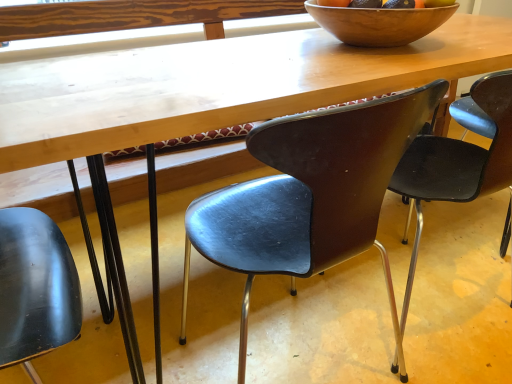
The width and height of the screenshot is (512, 384). Describe the element at coordinates (35, 287) in the screenshot. I see `matte black chair at lower left, which is counted as the first chair, starting from the left` at that location.

Measure the distance between matte brown chair at upper right, which is the third chair in left-to-right order, and camera.

A distance of 30.34 inches exists between matte brown chair at upper right, which is the third chair in left-to-right order, and camera.

The width and height of the screenshot is (512, 384). What do you see at coordinates (309, 196) in the screenshot?
I see `matte black chair at center, arranged as the second chair when viewed from the left` at bounding box center [309, 196].

Locate an element on the screen. The width and height of the screenshot is (512, 384). matte black chair at lower left, the 3th chair when ordered from right to left is located at coordinates (35, 287).

Considering the sizes of objects matte brown chair at upper right, the first chair from the right, and wooden bowl at upper center in the image provided, who is thinner, matte brown chair at upper right, the first chair from the right, or wooden bowl at upper center?

With smaller width is wooden bowl at upper center.

Which object is positioned more to the left, matte brown chair at upper right, which is the third chair in left-to-right order, or wooden bowl at upper center?

Positioned to the left is wooden bowl at upper center.

Would you say wooden bowl at upper center is part of matte brown chair at upper right, the first chair from the right,'s contents?

No, wooden bowl at upper center is located outside of matte brown chair at upper right, the first chair from the right.

Which of these two, matte brown chair at upper right, which is the third chair in left-to-right order, or wooden bowl at upper center, is bigger?

With larger size is matte brown chair at upper right, which is the third chair in left-to-right order.

Who is smaller, matte black chair at center, the second chair viewed from the right, or wooden bowl at upper center?

With smaller size is wooden bowl at upper center.

From the image's perspective, between matte black chair at center, the second chair viewed from the right, and wooden bowl at upper center, which one is located above?

From the image's view, wooden bowl at upper center is above.

Which point is more distant from viewer, [256,146] or [362,23]?

The point [362,23] is farther.

Considering the sizes of objects matte black chair at center, arranged as the second chair when viewed from the left, and wooden bowl at upper center in the image provided, who is taller, matte black chair at center, arranged as the second chair when viewed from the left, or wooden bowl at upper center?

matte black chair at center, arranged as the second chair when viewed from the left.

Is wooden bowl at upper center not within matte black chair at center, the second chair viewed from the right?

wooden bowl at upper center lies outside matte black chair at center, the second chair viewed from the right,'s area.

Does wooden bowl at upper center have a greater height compared to matte black chair at center, arranged as the second chair when viewed from the left?

No.

Does point (417, 9) appear closer or farther from the camera than point (308, 131)?

Point (417, 9) is farther from the camera than point (308, 131).

Consider the image. Does wooden bowl at upper center have a lesser height compared to matte black chair at lower left, the 3th chair when ordered from right to left?

Yes, wooden bowl at upper center is shorter than matte black chair at lower left, the 3th chair when ordered from right to left.

Between wooden bowl at upper center and matte black chair at lower left, which is counted as the first chair, starting from the left, which one has smaller width?

matte black chair at lower left, which is counted as the first chair, starting from the left, is thinner.

From a real-world perspective, is wooden bowl at upper center physically below matte black chair at lower left, the 3th chair when ordered from right to left?

No, from a real-world perspective, wooden bowl at upper center is not under matte black chair at lower left, the 3th chair when ordered from right to left.

From the image's perspective, who appears lower, matte brown chair at upper right, which is the third chair in left-to-right order, or matte black chair at center, the second chair viewed from the right?

matte black chair at center, the second chair viewed from the right, is shown below in the image.

Between matte brown chair at upper right, which is the third chair in left-to-right order, and matte black chair at center, arranged as the second chair when viewed from the left, which one has larger size?

matte black chair at center, arranged as the second chair when viewed from the left.

Is point (506, 144) closer to viewer compared to point (185, 219)?

Yes.

How different are the orientations of matte brown chair at upper right, which is the third chair in left-to-right order, and matte black chair at center, the second chair viewed from the right, in degrees?

0.000337 degrees.

Considering the relative sizes of matte black chair at lower left, which is counted as the first chair, starting from the left, and wooden bowl at upper center in the image provided, is matte black chair at lower left, which is counted as the first chair, starting from the left, bigger than wooden bowl at upper center?

Yes.

Would you say matte black chair at lower left, which is counted as the first chair, starting from the left, is to the left or to the right of wooden bowl at upper center in the picture?

matte black chair at lower left, which is counted as the first chair, starting from the left, is to the left of wooden bowl at upper center.

Is matte black chair at lower left, the 3th chair when ordered from right to left, in front of or behind wooden bowl at upper center in the image?

matte black chair at lower left, the 3th chair when ordered from right to left, is in front of wooden bowl at upper center.

There is a matte black chair at lower left, which is counted as the first chair, starting from the left. At what (x,y) coordinates should I click in order to perform the action: click on bowl above it (from a real-world perspective). Please return your answer as a coordinate pair (x, y). This screenshot has height=384, width=512. Looking at the image, I should click on (379, 23).

Considering the sizes of objects matte black chair at center, arranged as the second chair when viewed from the left, and matte brown chair at upper right, which is the third chair in left-to-right order, in the image provided, who is wider, matte black chair at center, arranged as the second chair when viewed from the left, or matte brown chair at upper right, which is the third chair in left-to-right order,?

matte black chair at center, arranged as the second chair when viewed from the left.

Based on the photo, from a real-world perspective, is matte black chair at center, the second chair viewed from the right, above or below matte brown chair at upper right, the first chair from the right?

matte black chair at center, the second chair viewed from the right, is situated higher than matte brown chair at upper right, the first chair from the right, in the real world.

Considering the sizes of objects matte black chair at center, the second chair viewed from the right, and matte brown chair at upper right, the first chair from the right, in the image provided, who is taller, matte black chair at center, the second chair viewed from the right, or matte brown chair at upper right, the first chair from the right,?

With more height is matte black chair at center, the second chair viewed from the right.

Does matte black chair at center, the second chair viewed from the right, lie in front of matte brown chair at upper right, which is the third chair in left-to-right order?

Yes.

Where is `chair that is the 1st object located in front of the wooden bowl at upper center`? The height and width of the screenshot is (384, 512). chair that is the 1st object located in front of the wooden bowl at upper center is located at coordinates (457, 164).

Where is `bowl lying on the right of matte black chair at center, arranged as the second chair when viewed from the left`? The image size is (512, 384). bowl lying on the right of matte black chair at center, arranged as the second chair when viewed from the left is located at coordinates (379, 23).

Based on their spatial positions, is matte black chair at center, the second chair viewed from the right, or matte black chair at lower left, which is counted as the first chair, starting from the left, closer to wooden bowl at upper center?

Based on the image, matte black chair at center, the second chair viewed from the right, appears to be nearer to wooden bowl at upper center.

Looking at the image, which one is located further to wooden bowl at upper center, matte black chair at center, the second chair viewed from the right, or matte brown chair at upper right, which is the third chair in left-to-right order?

matte black chair at center, the second chair viewed from the right, is further to wooden bowl at upper center.

Estimate the real-world distances between objects in this image. Which object is further from matte black chair at lower left, which is counted as the first chair, starting from the left, matte brown chair at upper right, the first chair from the right, or wooden bowl at upper center?

Based on the image, matte brown chair at upper right, the first chair from the right, appears to be further to matte black chair at lower left, which is counted as the first chair, starting from the left.

Considering their positions, is wooden bowl at upper center positioned further to matte black chair at lower left, the 3th chair when ordered from right to left, than matte brown chair at upper right, the first chair from the right?

matte brown chair at upper right, the first chair from the right.

From the image, which object appears to be farther from wooden bowl at upper center, matte black chair at lower left, the 3th chair when ordered from right to left, or matte black chair at center, arranged as the second chair when viewed from the left?

matte black chair at lower left, the 3th chair when ordered from right to left, is further to wooden bowl at upper center.

Estimate the real-world distances between objects in this image. Which object is closer to matte brown chair at upper right, the first chair from the right, matte black chair at center, the second chair viewed from the right, or wooden bowl at upper center?

matte black chair at center, the second chair viewed from the right, lies closer to matte brown chair at upper right, the first chair from the right, than the other object.

Estimate the real-world distances between objects in this image. Which object is further from wooden bowl at upper center, matte brown chair at upper right, which is the third chair in left-to-right order, or matte black chair at lower left, which is counted as the first chair, starting from the left?

matte black chair at lower left, which is counted as the first chair, starting from the left, is positioned further to the anchor wooden bowl at upper center.

In the scene shown: When comparing their distances from matte black chair at center, arranged as the second chair when viewed from the left, does matte black chair at lower left, the 3th chair when ordered from right to left, or wooden bowl at upper center seem closer?

wooden bowl at upper center.

Where is `chair between matte black chair at lower left, the 3th chair when ordered from right to left, and matte brown chair at upper right, which is the third chair in left-to-right order`? chair between matte black chair at lower left, the 3th chair when ordered from right to left, and matte brown chair at upper right, which is the third chair in left-to-right order is located at coordinates (309, 196).

Where is `chair between matte black chair at lower left, which is counted as the first chair, starting from the left, and wooden bowl at upper center from left to right`? chair between matte black chair at lower left, which is counted as the first chair, starting from the left, and wooden bowl at upper center from left to right is located at coordinates (309, 196).

At what (x,y) coordinates should I click in order to perform the action: click on bowl between matte black chair at lower left, which is counted as the first chair, starting from the left, and matte brown chair at upper right, which is the third chair in left-to-right order. Please return your answer as a coordinate pair (x, y). This screenshot has height=384, width=512. Looking at the image, I should click on pyautogui.click(x=379, y=23).

The height and width of the screenshot is (384, 512). Identify the location of chair between wooden bowl at upper center and matte black chair at center, the second chair viewed from the right, in the vertical direction. (457, 164).